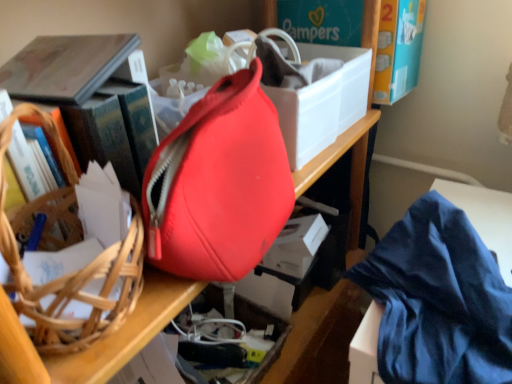
You are a GUI agent. You are given a task and a screenshot of the screen. Output one action in this format:
    pyautogui.click(x=<x>, y=<y>)
    Task: Click on the matte red bag at center
    Image resolution: width=512 pixels, height=384 pixels.
    Given the screenshot: What is the action you would take?
    pyautogui.click(x=219, y=184)

Locate an element on the screen. The width and height of the screenshot is (512, 384). white matte storage box at center is located at coordinates (296, 245).

I want to click on brown woven basket at left, so click(73, 272).

Is matte red bag at center further to the viewer compared to blue silky cloth at lower right?

That is False.

Is matte red bag at center facing towards blue silky cloth at lower right?

No, matte red bag at center does not turn towards blue silky cloth at lower right.

Looking at their sizes, would you say matte red bag at center is wider or thinner than blue silky cloth at lower right?

In the image, matte red bag at center appears to be more narrow than blue silky cloth at lower right.

From the image's perspective, which one is positioned higher, matte red bag at center or blue silky cloth at lower right?

From the image's view, matte red bag at center is above.

Between brown woven basket at left and white matte storage box at center, which one is positioned behind?

white matte storage box at center is further away from the camera.

Are brown woven basket at left and white matte storage box at center located far from each other?

They are positioned close to each other.

Considering the positions of objects brown woven basket at left and white matte storage box at center in the image provided, who is more to the right, brown woven basket at left or white matte storage box at center?

From the viewer's perspective, white matte storage box at center appears more on the right side.

Considering the relative sizes of brown woven basket at left and white matte storage box at center in the image provided, is brown woven basket at left wider than white matte storage box at center?

Yes.

Can you tell me how much white matte storage box at center and matte red bag at center differ in facing direction?

The angle between the facing direction of white matte storage box at center and the facing direction of matte red bag at center is 1.96 degrees.

Could you tell me if white matte storage box at center is turned towards matte red bag at center?

No.

Is white matte storage box at center next to matte red bag at center and touching it?

There is a gap between white matte storage box at center and matte red bag at center.

Which of these two, white matte storage box at center or matte red bag at center, is smaller?

With smaller size is white matte storage box at center.

Can you confirm if hardcover book at left is shorter than brown woven basket at left?

Correct, hardcover book at left is not as tall as brown woven basket at left.

Choose the correct answer: Is hardcover book at left inside brown woven basket at left or outside it?

The correct answer is: outside.

Is hardcover book at left positioned behind brown woven basket at left?

Yes, hardcover book at left is further from the camera.

Is hardcover book at left to the right of brown woven basket at left from the viewer's perspective?

No, hardcover book at left is not to the right of brown woven basket at left.

Identify the location of book that is above the white matte storage box at center (from a real-world perspective). The width and height of the screenshot is (512, 384). (90, 93).

Can you tell me how much hardcover book at left and white matte storage box at center differ in facing direction?

There is a 0.781-degree angle between the facing directions of hardcover book at left and white matte storage box at center.

Considering the sizes of objects hardcover book at left and white matte storage box at center in the image provided, who is thinner, hardcover book at left or white matte storage box at center?

white matte storage box at center is thinner.

Are hardcover book at left and white matte storage box at center beside each other?

No, hardcover book at left is not in contact with white matte storage box at center.

Where is `clothe located on the right of hardcover book at left`? The image size is (512, 384). clothe located on the right of hardcover book at left is located at coordinates (438, 300).

Is hardcover book at left not near blue silky cloth at lower right?

hardcover book at left is actually quite close to blue silky cloth at lower right.

Is hardcover book at left at the left side of blue silky cloth at lower right?

Yes.

Considering the relative sizes of white matte storage box at center and hardcover book at left in the image provided, is white matte storage box at center thinner than hardcover book at left?

Yes.

Can you confirm if white matte storage box at center is positioned to the right of hardcover book at left?

Yes, white matte storage box at center is to the right of hardcover book at left.

From a real-world perspective, between white matte storage box at center and hardcover book at left, who is vertically lower?

white matte storage box at center.

From the image's perspective, does white matte storage box at center appear higher than hardcover book at left?

No.

I want to click on handbag above the blue silky cloth at lower right (from the image's perspective), so click(x=219, y=184).

Find the location of a particular element. The width and height of the screenshot is (512, 384). storage box located below the brown woven basket at left (from the image's perspective) is located at coordinates (296, 245).

Looking at the image, which one is located further to matte red bag at center, white matte storage box at center or brown woven basket at left?

white matte storage box at center lies further to matte red bag at center than the other object.

From the image, which object appears to be nearer to brown woven basket at left, white matte storage box at center or matte red bag at center?

matte red bag at center lies closer to brown woven basket at left than the other object.

Looking at the image, which one is located further to white matte storage box at center, hardcover book at left or matte red bag at center?

hardcover book at left is further to white matte storage box at center.

Considering their positions, is blue silky cloth at lower right positioned further to matte red bag at center than white matte storage box at center?

The object further to matte red bag at center is white matte storage box at center.

Based on their spatial positions, is blue silky cloth at lower right or brown woven basket at left further from white matte storage box at center?

Based on the image, brown woven basket at left appears to be further to white matte storage box at center.

Based on their spatial positions, is brown woven basket at left or blue silky cloth at lower right closer to hardcover book at left?

brown woven basket at left.

Based on their spatial positions, is white matte storage box at center or brown woven basket at left closer to hardcover book at left?

brown woven basket at left lies closer to hardcover book at left than the other object.

Estimate the real-world distances between objects in this image. Which object is further from hardcover book at left, matte red bag at center or white matte storage box at center?

white matte storage box at center lies further to hardcover book at left than the other object.

At what (x,y) coordinates should I click in order to perform the action: click on book between matte red bag at center and white matte storage box at center along the z-axis. Please return your answer as a coordinate pair (x, y). The image size is (512, 384). Looking at the image, I should click on coord(90,93).

Locate an element on the screen. The image size is (512, 384). storage box between hardcover book at left and blue silky cloth at lower right in the horizontal direction is located at coordinates (296, 245).

Where is `basket situated between hardcover book at left and blue silky cloth at lower right from left to right`? Image resolution: width=512 pixels, height=384 pixels. basket situated between hardcover book at left and blue silky cloth at lower right from left to right is located at coordinates (73, 272).

This screenshot has width=512, height=384. Find the location of `clothe positioned between brown woven basket at left and white matte storage box at center from near to far`. clothe positioned between brown woven basket at left and white matte storage box at center from near to far is located at coordinates (438, 300).